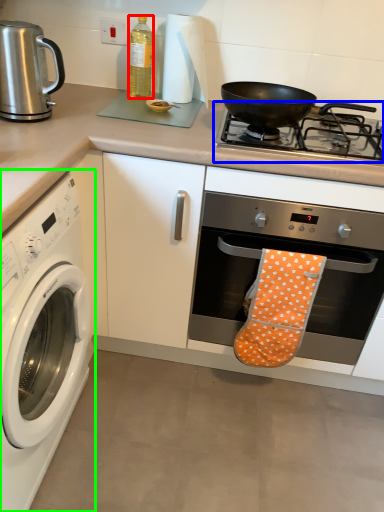
Question: Which object is the closest to the bottle (highlighted by a red box)? Choose among these: gas stove (highlighted by a blue box) or washing machine (highlighted by a green box).

Choices:
 (A) gas stove
 (B) washing machine

Answer: (A)